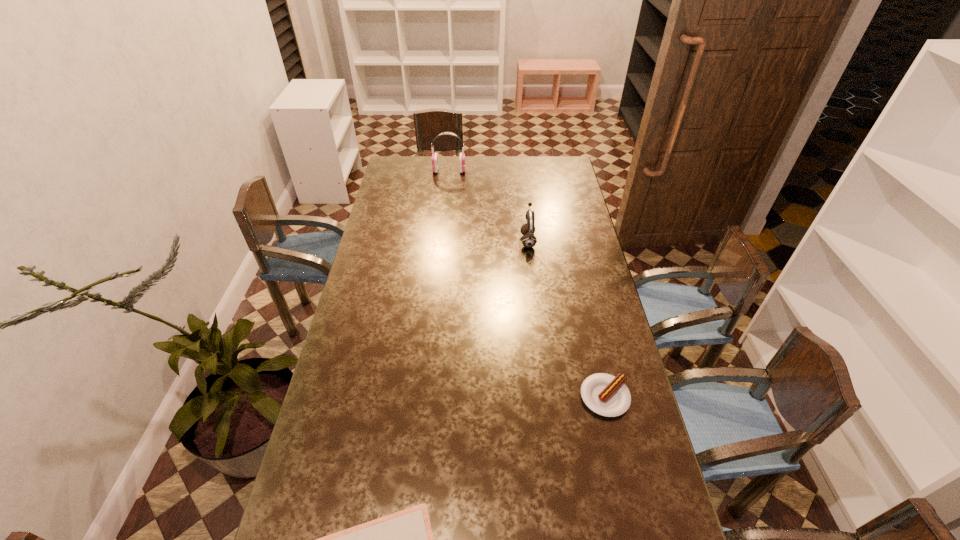
Identify the location of vacant space located 0.060m on the back of the third farthest object. This screenshot has width=960, height=540. (596, 360).

Locate an element on the screen. The height and width of the screenshot is (540, 960). object that is positioned at the far edge is located at coordinates (434, 159).

Image resolution: width=960 pixels, height=540 pixels. Find the location of `object present at the right edge`. object present at the right edge is located at coordinates (606, 395).

Locate an element on the screen. Image resolution: width=960 pixels, height=540 pixels. vacant space at the far edge of the desktop is located at coordinates (488, 159).

The image size is (960, 540). I want to click on vacant point at the left edge, so click(x=389, y=283).

The image size is (960, 540). I want to click on blank space at the right edge of the desktop, so click(x=637, y=491).

The image size is (960, 540). In order to click on free space at the far left corner of the desktop in this screenshot , I will do `click(395, 170)`.

Locate an element on the screen. This screenshot has height=540, width=960. vacant space at the far right corner of the desktop is located at coordinates (562, 165).

Find the location of a particular element. The width and height of the screenshot is (960, 540). unoccupied position between the sausage and the farther earphone is located at coordinates (527, 284).

Find the location of a particular element. This screenshot has width=960, height=540. vacant point located between the rightmost object and the shorter earphone is located at coordinates (566, 319).